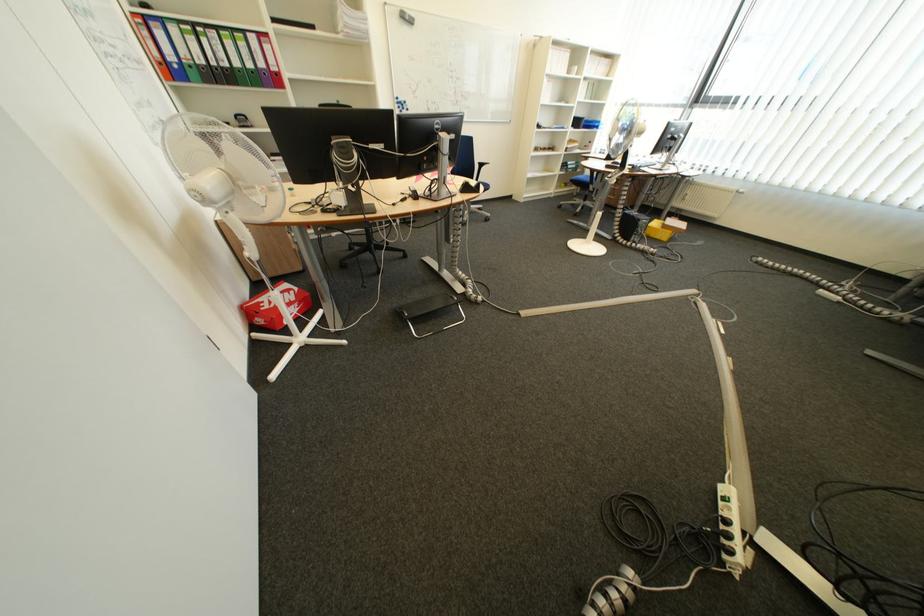
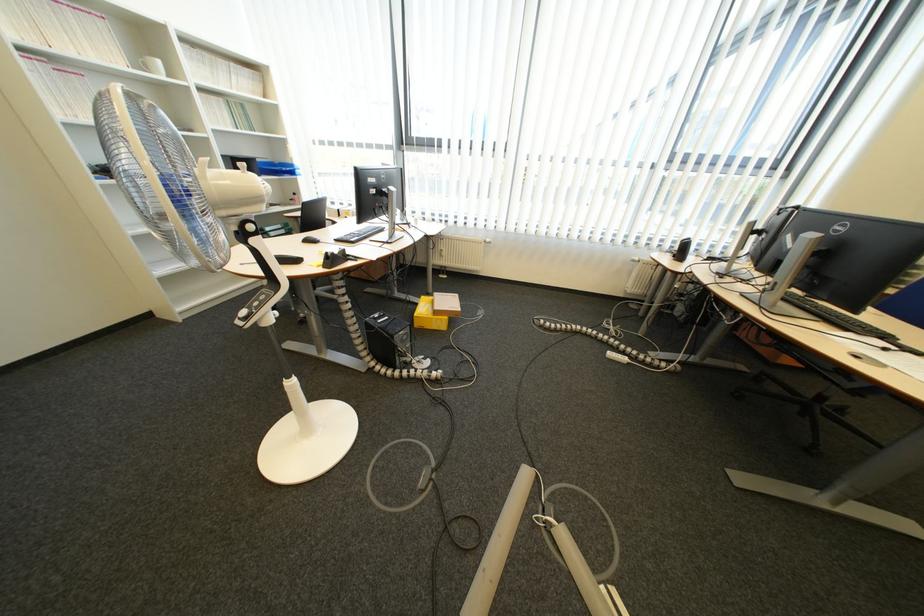
The point at (853, 286) is marked in the first image. Where is the corresponding point in the second image?

(619, 331)